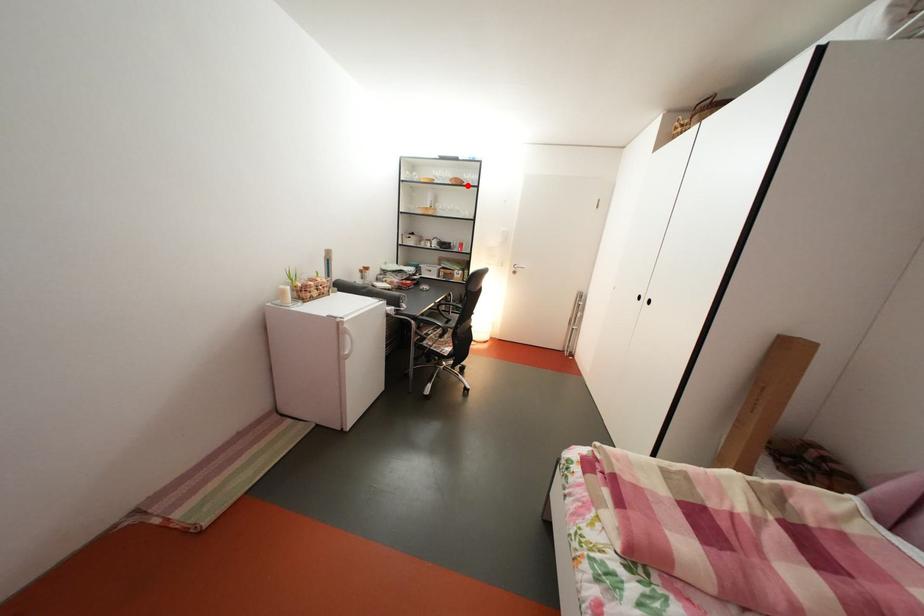
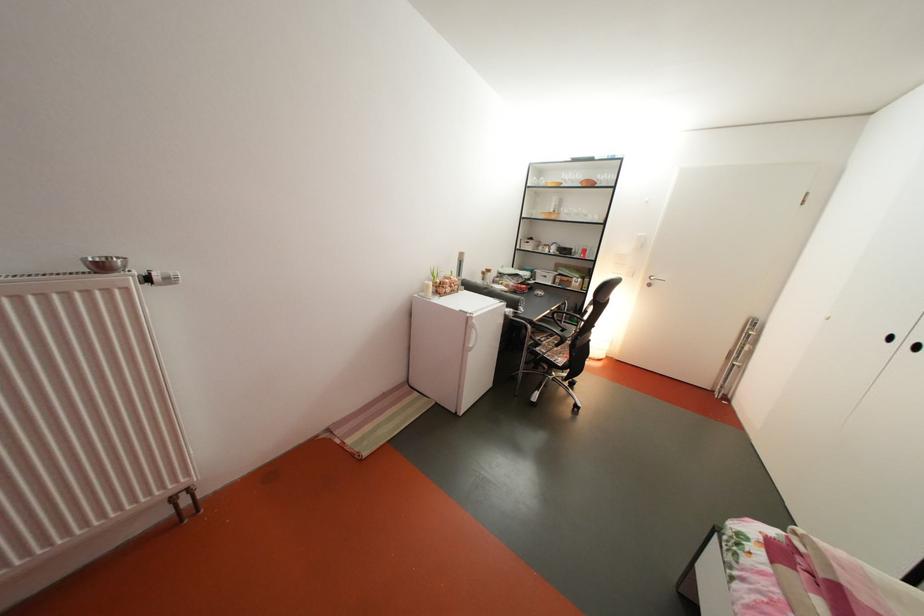
The point at the highlighted location is marked in the first image. Where is the corresponding point in the second image?

(600, 187)